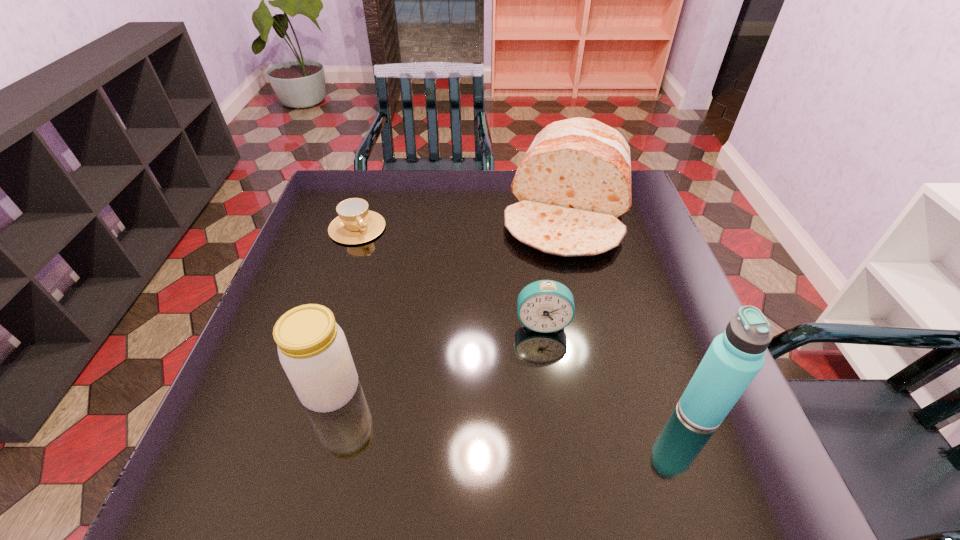
This screenshot has width=960, height=540. I want to click on vacant spot on the desktop that is between the jar and the tallest object and is positioned on the front-facing side of the fourth tallest object, so click(545, 402).

Where is `free spot on the desktop that is between the jar and the thermos bottle and is positioned at the sliced end of the bread`? The width and height of the screenshot is (960, 540). free spot on the desktop that is between the jar and the thermos bottle and is positioned at the sliced end of the bread is located at coordinates (520, 401).

The image size is (960, 540). In order to click on free space on the desktop that is between the jar and the tallest object and is positioned with the handle on the side of the cup in this screenshot , I will do `click(475, 399)`.